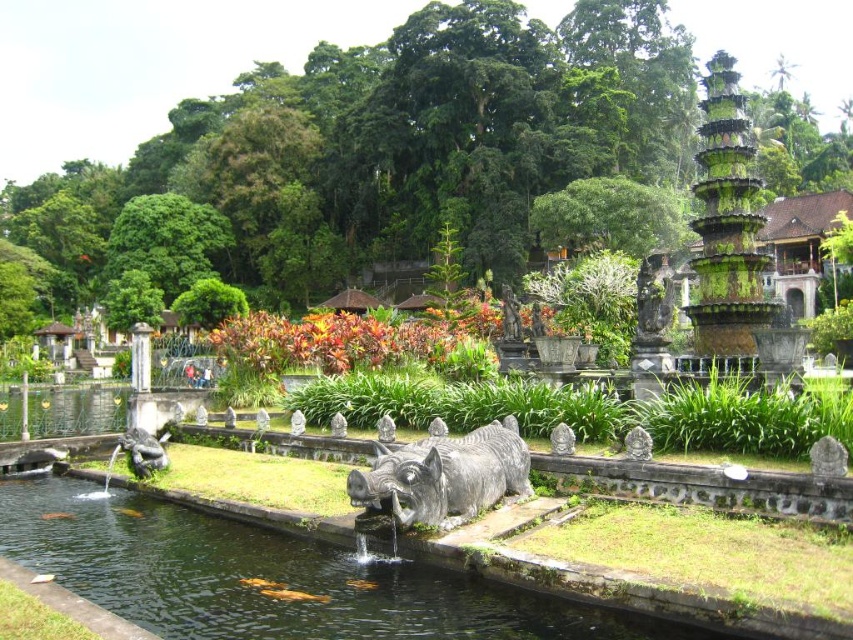
Which is more to the left, smooth stone pond at center or gray stone statue at center?

smooth stone pond at center is more to the left.

Which of these two, smooth stone pond at center or gray stone statue at center, stands taller?

With more height is smooth stone pond at center.

Is point (392, 632) behind point (419, 522)?

No.

Where is `smooth stone pond at center`? This screenshot has width=853, height=640. smooth stone pond at center is located at coordinates (270, 579).